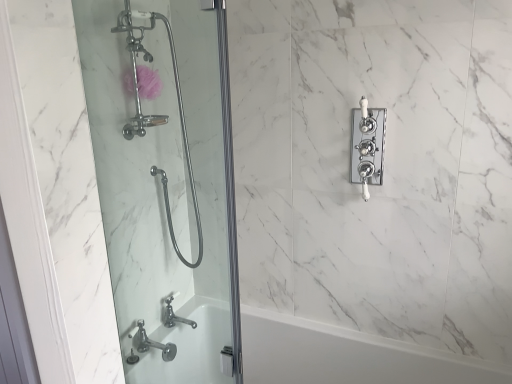
Image resolution: width=512 pixels, height=384 pixels. In order to click on clear glass shower door at left in this screenshot , I will do `click(166, 186)`.

You are a GUI agent. You are given a task and a screenshot of the screen. Output one action in this format:
    pyautogui.click(x=<x>, y=<y>)
    Task: Click on the white ceramic faucet at upper right
    
    Given the screenshot: What is the action you would take?
    pyautogui.click(x=367, y=146)

What do you see at coordinates (151, 343) in the screenshot? I see `polished chrome faucet at lower left` at bounding box center [151, 343].

Image resolution: width=512 pixels, height=384 pixels. What do you see at coordinates (346, 356) in the screenshot?
I see `white glossy bathtub at lower left` at bounding box center [346, 356].

I want to click on clear glass shower door at left, so click(166, 186).

Considering the sizes of objects clear glass shower door at left and polished chrome faucet at lower left in the image provided, who is taller, clear glass shower door at left or polished chrome faucet at lower left?

With more height is clear glass shower door at left.

Identify the location of screen door that appears above the polished chrome faucet at lower left (from the image's perspective). (166, 186).

Is clear glass shower door at left oriented away from polished chrome faucet at lower left?

Yes, clear glass shower door at left is facing away from polished chrome faucet at lower left.

Can you confirm if clear glass shower door at left is wider than polished chrome faucet at lower left?

Incorrect, the width of clear glass shower door at left does not surpass that of polished chrome faucet at lower left.

Locate an element on the screen. This screenshot has width=512, height=384. sink above the white glossy bathtub at lower left (from a real-world perspective) is located at coordinates (151, 343).

Does polished chrome faucet at lower left touch white glossy bathtub at lower left?

No, polished chrome faucet at lower left is not touching white glossy bathtub at lower left.

Considering the sizes of objects polished chrome faucet at lower left and white glossy bathtub at lower left in the image provided, who is wider, polished chrome faucet at lower left or white glossy bathtub at lower left?

Wider between the two is white glossy bathtub at lower left.

From a real-world perspective, who is located higher, polished chrome faucet at lower left or white glossy bathtub at lower left?

In real-world perspective, polished chrome faucet at lower left is above.

Is clear glass shower door at left bigger or smaller than pink sponge at upper left?

clear glass shower door at left is bigger than pink sponge at upper left.

Locate an element on the screen. The width and height of the screenshot is (512, 384). flower located above the clear glass shower door at left (from a real-world perspective) is located at coordinates (148, 82).

Would you say clear glass shower door at left is to the left or to the right of pink sponge at upper left in the picture?

From the image, it's evident that clear glass shower door at left is to the right of pink sponge at upper left.

Consider the image. Is clear glass shower door at left turned away from pink sponge at upper left?

Yes, clear glass shower door at left's orientation is away from pink sponge at upper left.

How different are the orientations of clear glass shower door at left and white ceramic faucet at upper right in degrees?

0.904 degrees.

Can you confirm if clear glass shower door at left is shorter than white ceramic faucet at upper right?

Incorrect, the height of clear glass shower door at left does not fall short of that of white ceramic faucet at upper right.

From the image's perspective, between clear glass shower door at left and white ceramic faucet at upper right, who is located below?

clear glass shower door at left is shown below in the image.

Which object is thinner, pink sponge at upper left or white ceramic faucet at upper right?

With smaller width is white ceramic faucet at upper right.

From the image's perspective, is pink sponge at upper left beneath white ceramic faucet at upper right?

No, from the image's perspective, pink sponge at upper left is not below white ceramic faucet at upper right.

Could white ceramic faucet at upper right be considered to be inside pink sponge at upper left?

No, white ceramic faucet at upper right is not surrounded by pink sponge at upper left.

How different are the orientations of pink sponge at upper left and white ceramic faucet at upper right in degrees?

They differ by 90.8 degrees in their facing directions.

Does white ceramic faucet at upper right have a lesser height compared to white glossy bathtub at lower left?

Yes, white ceramic faucet at upper right is shorter than white glossy bathtub at lower left.

Visually, is white ceramic faucet at upper right positioned to the left or to the right of white glossy bathtub at lower left?

white ceramic faucet at upper right is to the right of white glossy bathtub at lower left.

Is point (379, 166) more distant than point (302, 373)?

No, (379, 166) is closer to viewer.

Is the position of white ceramic faucet at upper right less distant than that of white glossy bathtub at lower left?

No, white ceramic faucet at upper right is further to the viewer.

The image size is (512, 384). I want to click on screen door that is under the white ceramic faucet at upper right (from a real-world perspective), so [x=166, y=186].

From the image's perspective, does white ceramic faucet at upper right appear lower than clear glass shower door at left?

Actually, white ceramic faucet at upper right appears above clear glass shower door at left in the image.

Is white ceramic faucet at upper right behind clear glass shower door at left?

Yes, it is.

Identify the location of sink on the left side of clear glass shower door at left. (151, 343).

What are the coordinates of `bath below the polished chrome faucet at lower left (from a real-world perspective)` in the screenshot? It's located at point(346,356).

Based on their spatial positions, is white glossy bathtub at lower left or clear glass shower door at left further from polished chrome faucet at lower left?

clear glass shower door at left.

Considering their positions, is white glossy bathtub at lower left positioned further to clear glass shower door at left than white ceramic faucet at upper right?

The object further to clear glass shower door at left is white ceramic faucet at upper right.

When comparing their distances from pink sponge at upper left, does polished chrome faucet at lower left or white ceramic faucet at upper right seem closer?

white ceramic faucet at upper right lies closer to pink sponge at upper left than the other object.

Looking at the image, which one is located further to polished chrome faucet at lower left, pink sponge at upper left or clear glass shower door at left?

pink sponge at upper left is further to polished chrome faucet at lower left.

When comparing their distances from pink sponge at upper left, does white glossy bathtub at lower left or clear glass shower door at left seem closer?

clear glass shower door at left lies closer to pink sponge at upper left than the other object.

When comparing their distances from white ceramic faucet at upper right, does white glossy bathtub at lower left or polished chrome faucet at lower left seem closer?

Based on the image, white glossy bathtub at lower left appears to be nearer to white ceramic faucet at upper right.

Looking at the image, which one is located further to clear glass shower door at left, polished chrome faucet at lower left or white ceramic faucet at upper right?

white ceramic faucet at upper right.

When comparing their distances from white glossy bathtub at lower left, does white ceramic faucet at upper right or clear glass shower door at left seem further?

white ceramic faucet at upper right is positioned further to the anchor white glossy bathtub at lower left.

Image resolution: width=512 pixels, height=384 pixels. I want to click on screen door located between polished chrome faucet at lower left and white ceramic faucet at upper right in the left-right direction, so click(x=166, y=186).

Locate an element on the screen. This screenshot has width=512, height=384. screen door between white ceramic faucet at upper right and white glossy bathtub at lower left from top to bottom is located at coordinates (166, 186).

Find the location of a particular element. The image size is (512, 384). screen door between pink sponge at upper left and white glossy bathtub at lower left vertically is located at coordinates (166, 186).

Locate an element on the screen. The image size is (512, 384). lock between pink sponge at upper left and white glossy bathtub at lower left vertically is located at coordinates (x=367, y=146).